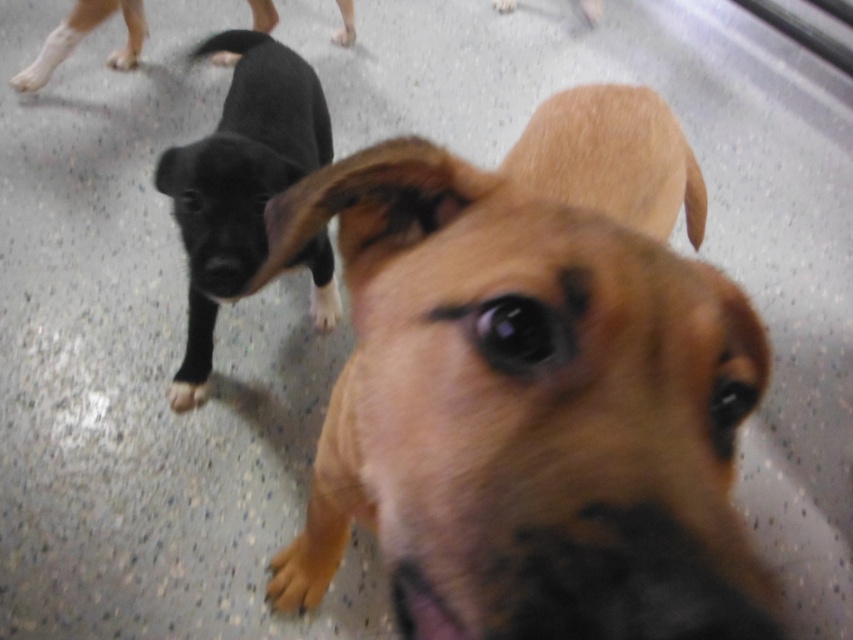
Question: Observing the image, what is the correct spatial positioning of brown furry dog at center in reference to shiny black puppy at left?

Choices:
 (A) left
 (B) right

Answer: (B)

Question: Can you confirm if brown furry dog at center is positioned below shiny black puppy at left?

Choices:
 (A) yes
 (B) no

Answer: (A)

Question: Is the position of brown furry dog at center less distant than that of shiny black puppy at left?

Choices:
 (A) no
 (B) yes

Answer: (B)